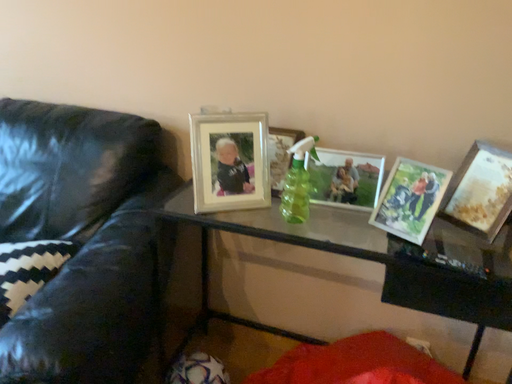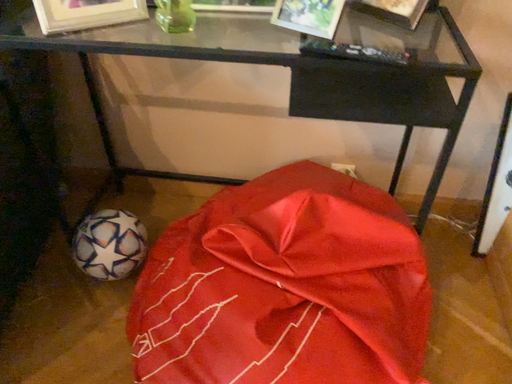
Question: How did the camera likely rotate when shooting the video?

Choices:
 (A) rotated left
 (B) rotated right

Answer: (B)